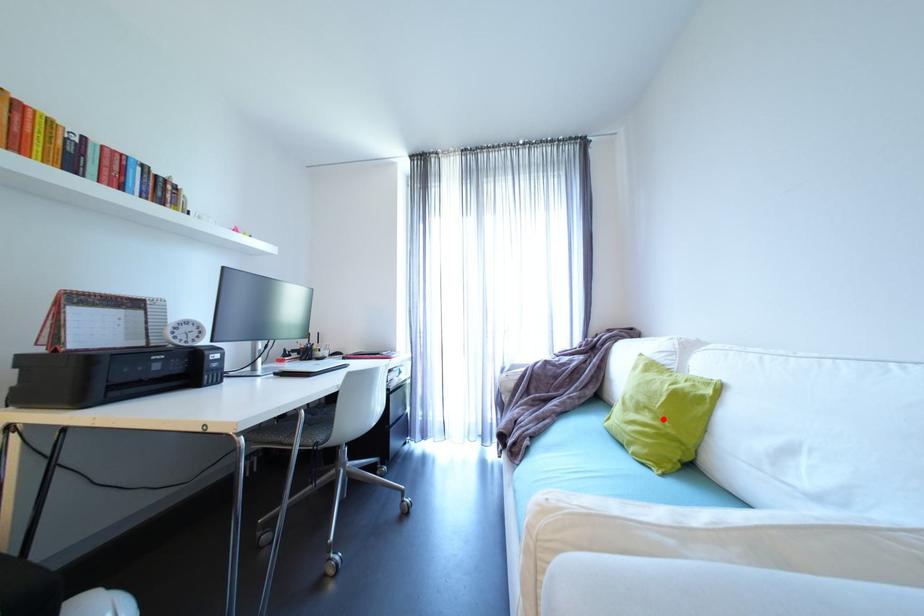
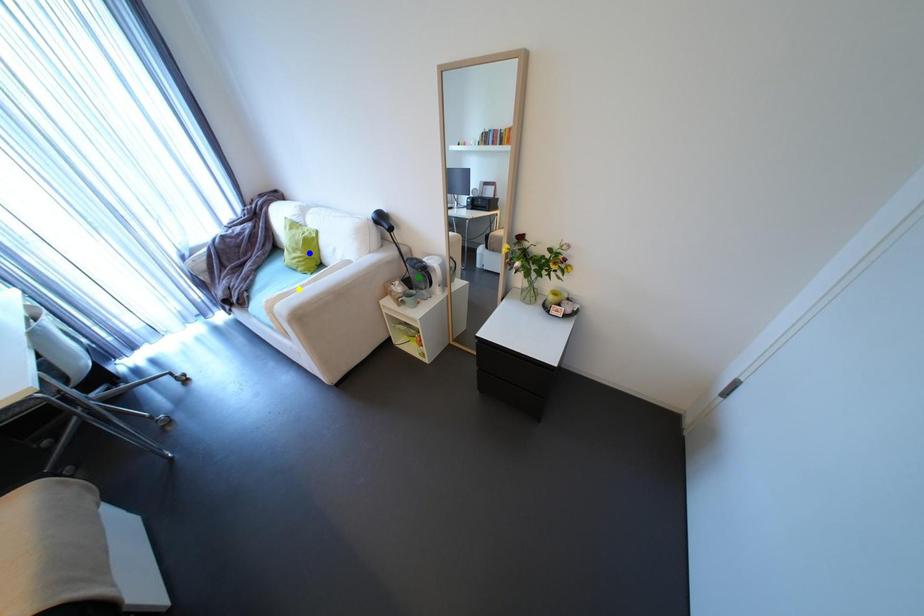
Question: I am providing you with two images of the same scene from different viewpoints. A red point is marked on the first image. You are given multiple points on the second image. Which spot in image 2 lines up with the point in image 1?

Choices:
 (A) green point
 (B) blue point
 (C) yellow point

Answer: (B)